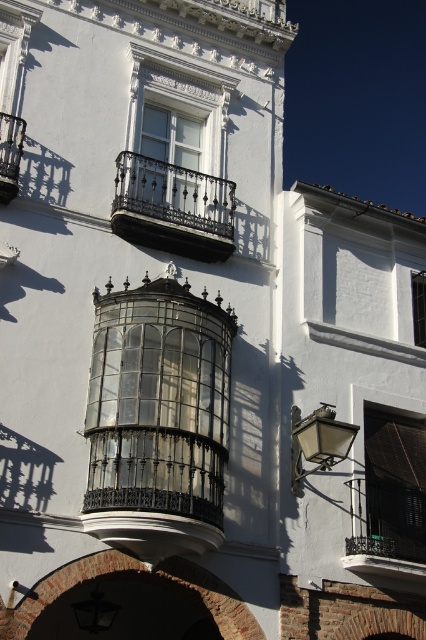
You are standing in front of the building and want to know which window is nearer to you. Can you tell me which one is closer between the dark brown wooden window at lower right and the white glass window at upper center?

The dark brown wooden window at lower right is closer to the viewer than the white glass window at upper center.